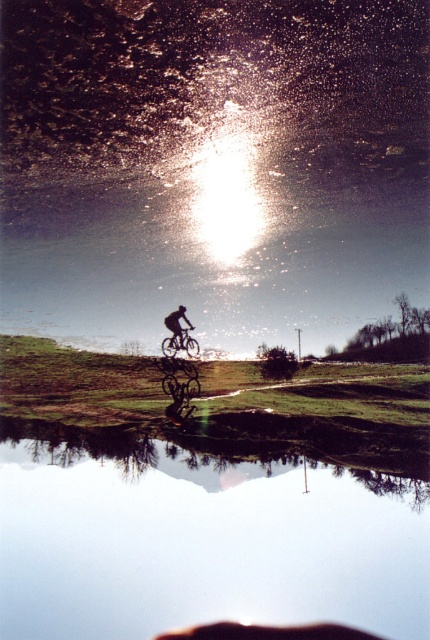
You are a photographer trying to capture the cyclist and the water in one shot. Since the shiny metallic bicycle at center and the transparent glass water at center are both in the scene, which one is closer to the camera?

The transparent glass water at center is closer to the camera because the shiny metallic bicycle at center is behind it.

You are a photographer trying to capture a clear shot of both the shiny metallic bicycle at center and the black matte bicycle at center. Since the sun is low in the sky, which bicycle might be harder to see due to glare? Explain your reasoning.

The shiny metallic bicycle at center might be harder to see due to glare because its reflective surface would bounce more light towards the camera, especially with the sun low in the sky. The black matte bicycle at center has a nonreflective surface, so it would absorb more light and appear darker but less affected by glare.

You are a drone operator trying to capture a photo of the cyclist. The drone is currently at point (203, 532), which is above the transparent glass water at center. To avoid crashing into the water, you need to adjust the drone to a higher altitude. Which direction should you move the drone to ascend safely?

The drone should move upward to ascend safely away from the transparent glass water at center located at point (203, 532).